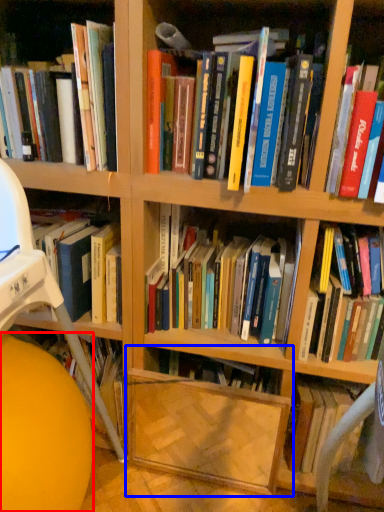
Question: Which object appears closest to the camera in this image, ball (highlighted by a red box) or shelf (highlighted by a blue box)?

Choices:
 (A) ball
 (B) shelf

Answer: (A)